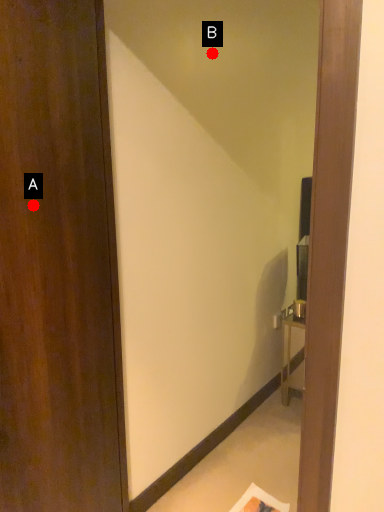
Question: Two points are circled on the image, labeled by A and B beside each circle. Which point is farther from the camera taking this photo?

Choices:
 (A) A is further
 (B) B is further

Answer: (B)